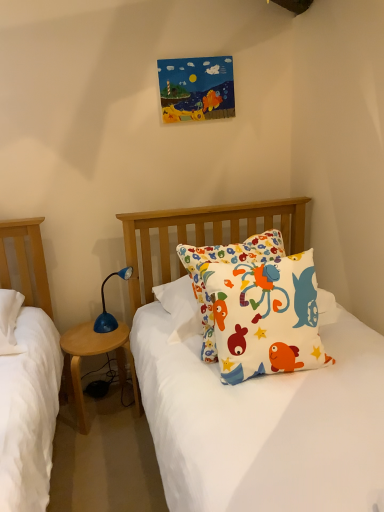
Question: In terms of width, does wooden nightstand at left look wider or thinner when compared to white cotton pillow with colorful fish designs at center?

Choices:
 (A) wide
 (B) thin

Answer: (A)

Question: Is point (62, 347) positioned closer to the camera than point (264, 372)?

Choices:
 (A) farther
 (B) closer

Answer: (A)

Question: Which object is positioned closest to the blue plastic lamp at lower left?

Choices:
 (A) wooden nightstand at left
 (B) white cotton pillow with colorful fish designs at center

Answer: (A)

Question: Which is nearer to the white cotton pillow with colorful fish designs at center?

Choices:
 (A) wooden nightstand at left
 (B) blue plastic lamp at lower left

Answer: (B)